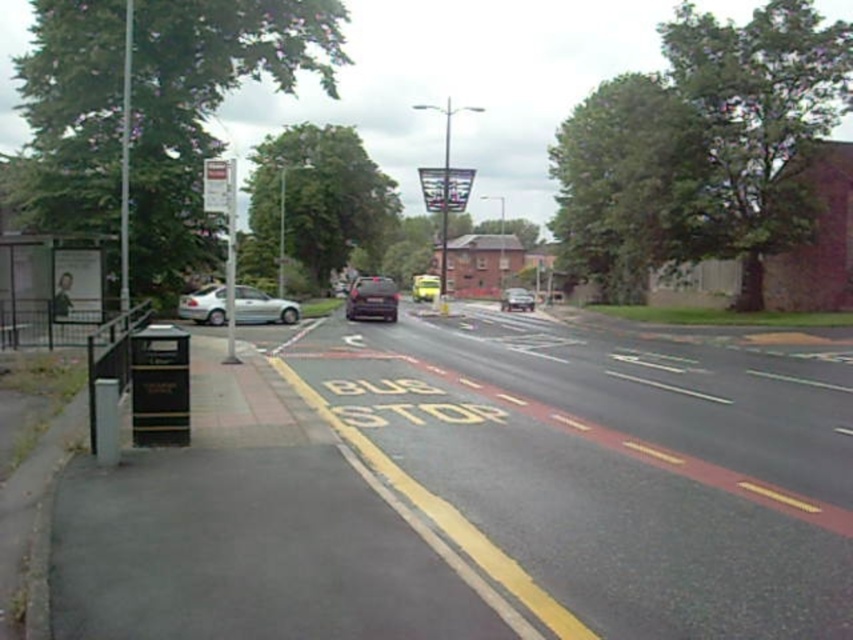
Describe the element at coordinates (372, 300) in the screenshot. I see `satin black car at center` at that location.

Is point (372, 300) more distant than point (503, 296)?

No, (372, 300) is closer to viewer.

Identify the location of satin black car at center. Image resolution: width=853 pixels, height=640 pixels. (372, 300).

Between silver metallic car at center and yellow matte car at center, which one appears on the left side from the viewer's perspective?

yellow matte car at center

Can you confirm if silver metallic car at center is positioned to the left of yellow matte car at center?

No, silver metallic car at center is not to the left of yellow matte car at center.

You are a GUI agent. You are given a task and a screenshot of the screen. Output one action in this format:
    pyautogui.click(x=<x>, y=<y>)
    Task: Click on the silver metallic car at center
    This screenshot has width=853, height=640.
    Given the screenshot: What is the action you would take?
    pyautogui.click(x=515, y=300)

Does silver metallic car at left have a smaller size compared to yellow matte car at center?

Yes, silver metallic car at left is smaller than yellow matte car at center.

Does silver metallic car at left appear over yellow matte car at center?

No.

Is point (238, 288) positioned after point (426, 296)?

No, (238, 288) is in front of (426, 296).

Locate an element on the screen. The height and width of the screenshot is (640, 853). silver metallic car at left is located at coordinates (262, 307).